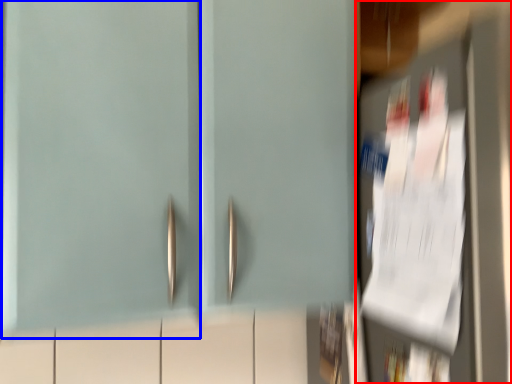
Question: Which object is further to the camera taking this photo, door (highlighted by a red box) or door (highlighted by a blue box)?

Choices:
 (A) door
 (B) door

Answer: (B)